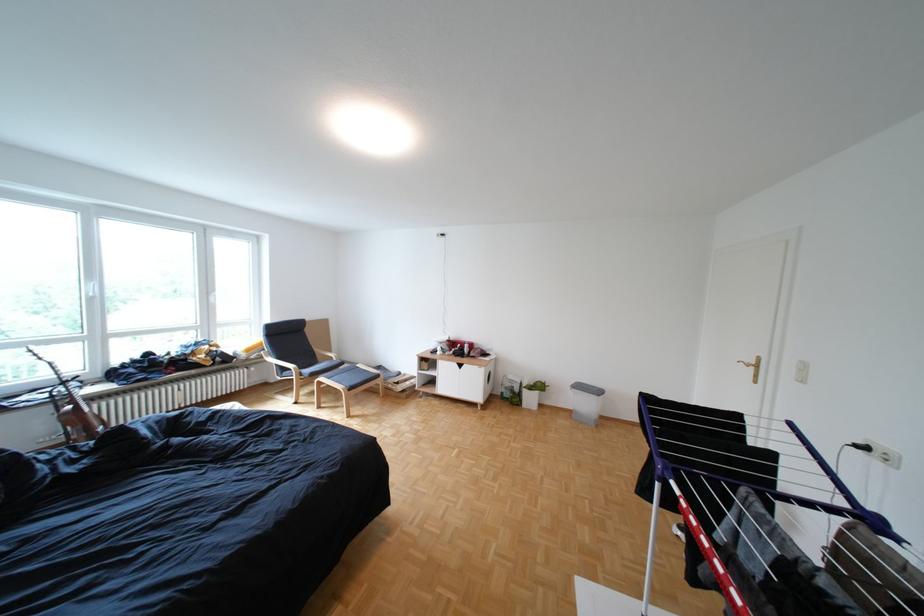
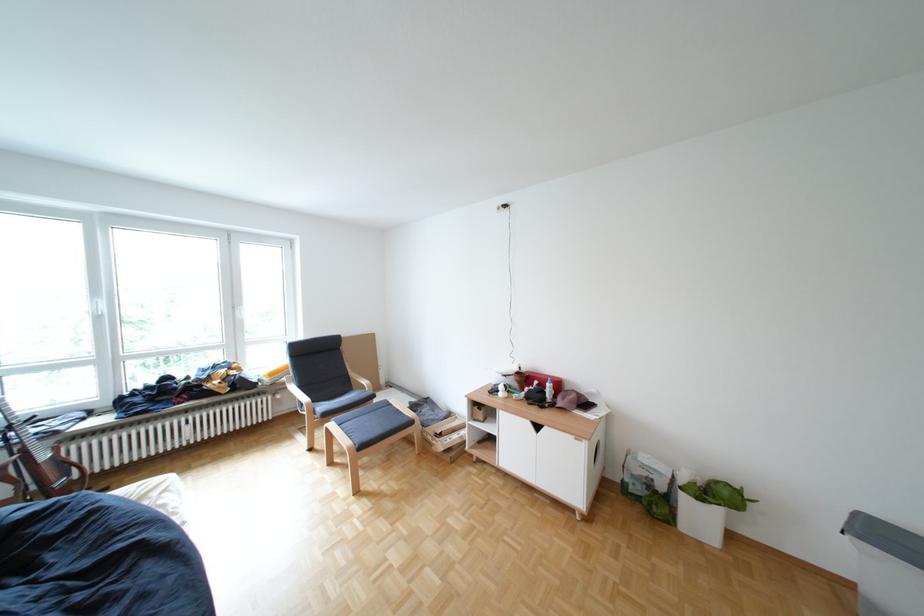
In the second image, find the point that corresponds to point 475,346 in the first image.

(552, 383)